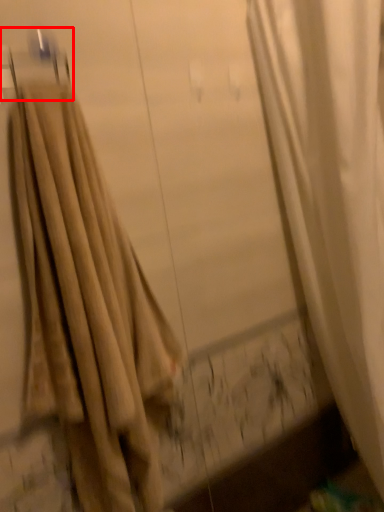
Question: Considering the relative positions of hanger (annotated by the red box) and curtain in the image provided, where is hanger (annotated by the red box) located with respect to the staircase?

Choices:
 (A) left
 (B) right

Answer: (A)